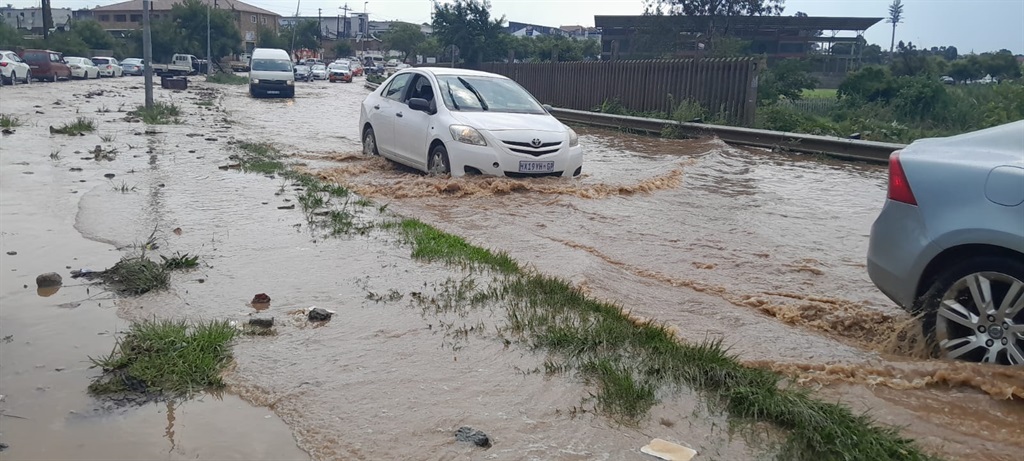
You are a GUI agent. You are given a task and a screenshot of the screen. Output one action in this format:
    pyautogui.click(x=<x>, y=<y>)
    Task: Click on the glass
    
    Given the screenshot: What is the action you would take?
    pyautogui.click(x=508, y=99)